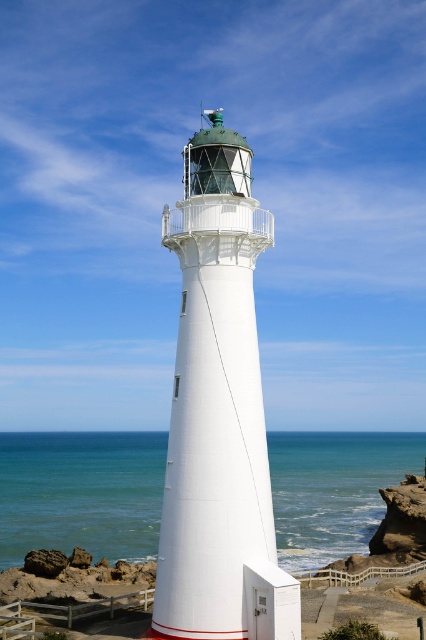
Who is taller, white smooth lighthouse at center or blue water at center?

white smooth lighthouse at center

Can you confirm if white smooth lighthouse at center is positioned to the right of blue water at center?

Yes, white smooth lighthouse at center is to the right of blue water at center.

Does point (250, 374) come behind point (360, 493)?

No, it is in front of (360, 493).

The width and height of the screenshot is (426, 640). In order to click on white smooth lighthouse at center in this screenshot , I will do `click(218, 413)`.